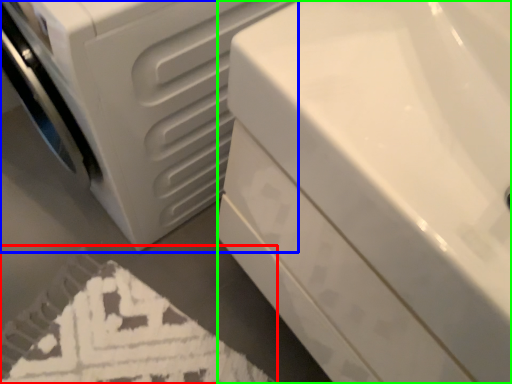
Question: Which object is positioned farthest from bath mat (highlighted by a red box)? Select from washing machine (highlighted by a blue box) and bath (highlighted by a green box).

Choices:
 (A) washing machine
 (B) bath

Answer: (B)